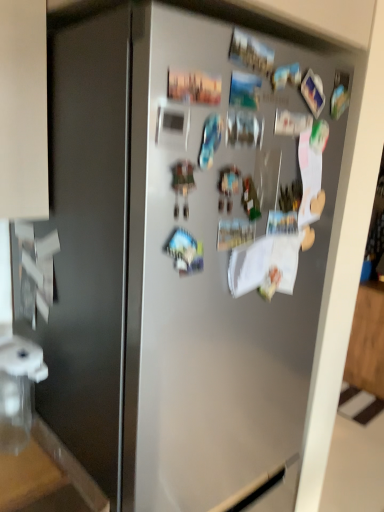
Where is `wooden countertop at lower left`? wooden countertop at lower left is located at coordinates coord(47,478).

What do you see at coordinates (47, 478) in the screenshot? This screenshot has height=512, width=384. I see `wooden countertop at lower left` at bounding box center [47, 478].

Image resolution: width=384 pixels, height=512 pixels. Identify the location of clear plastic water filter at lower left. (17, 389).

The width and height of the screenshot is (384, 512). What do you see at coordinates (17, 389) in the screenshot?
I see `clear plastic water filter at lower left` at bounding box center [17, 389].

At what (x,y) coordinates should I click in order to perform the action: click on wooden countertop at lower left. Please return your answer as a coordinate pair (x, y). Looking at the image, I should click on (47, 478).

Does clear plastic water filter at lower left appear on the left side of wooden countertop at lower left?

No.

Is clear plastic water filter at lower left closer to camera compared to wooden countertop at lower left?

No, clear plastic water filter at lower left is further to the viewer.

Is point (2, 451) closer to camera compared to point (57, 463)?

That is False.

From the image's perspective, is clear plastic water filter at lower left on top of wooden countertop at lower left?

Yes, from the image's perspective, clear plastic water filter at lower left is above wooden countertop at lower left.

From a real-world perspective, does clear plastic water filter at lower left stand above wooden countertop at lower left?

Yes, from a real-world perspective, clear plastic water filter at lower left is above wooden countertop at lower left.

Considering the sizes of clear plastic water filter at lower left and wooden countertop at lower left in the image, is clear plastic water filter at lower left wider or thinner than wooden countertop at lower left?

Considering their sizes, clear plastic water filter at lower left looks slimmer than wooden countertop at lower left.

Considering the sizes of objects clear plastic water filter at lower left and wooden countertop at lower left in the image provided, who is shorter, clear plastic water filter at lower left or wooden countertop at lower left?

Standing shorter between the two is wooden countertop at lower left.

Looking at the image, does clear plastic water filter at lower left seem bigger or smaller compared to wooden countertop at lower left?

Considering their sizes, clear plastic water filter at lower left takes up more space than wooden countertop at lower left.

Is clear plastic water filter at lower left located outside wooden countertop at lower left?

clear plastic water filter at lower left lies outside wooden countertop at lower left's area.

Is clear plastic water filter at lower left beside wooden countertop at lower left?

clear plastic water filter at lower left and wooden countertop at lower left are clearly separated.

Is clear plastic water filter at lower left oriented away from wooden countertop at lower left?

No, clear plastic water filter at lower left is not facing away from wooden countertop at lower left.

You are a GUI agent. You are given a task and a screenshot of the screen. Output one action in this format:
    pyautogui.click(x=<x>, y=<y>)
    Task: Click on the appliance above the wooden countertop at lower left (from the image's perspective)
    This screenshot has height=512, width=384.
    Given the screenshot: What is the action you would take?
    pyautogui.click(x=17, y=389)

Visually, is wooden countertop at lower left positioned to the left or to the right of clear plastic water filter at lower left?

In the image, wooden countertop at lower left appears on the left side of clear plastic water filter at lower left.

Which is in front, wooden countertop at lower left or clear plastic water filter at lower left?

wooden countertop at lower left is in front.

Between point (48, 478) and point (37, 381), which one is positioned in front?

The point (48, 478) is in front.

From the image's perspective, who appears lower, wooden countertop at lower left or clear plastic water filter at lower left?

From the image's view, wooden countertop at lower left is below.

From a real-world perspective, which is physically below, wooden countertop at lower left or clear plastic water filter at lower left?

In real-world perspective, wooden countertop at lower left is lower.

Between wooden countertop at lower left and clear plastic water filter at lower left, which one has smaller width?

Thinner between the two is clear plastic water filter at lower left.

Considering the relative sizes of wooden countertop at lower left and clear plastic water filter at lower left in the image provided, is wooden countertop at lower left shorter than clear plastic water filter at lower left?

Indeed, wooden countertop at lower left has a lesser height compared to clear plastic water filter at lower left.

Is wooden countertop at lower left smaller than clear plastic water filter at lower left?

Correct, wooden countertop at lower left occupies less space than clear plastic water filter at lower left.

Could clear plastic water filter at lower left be considered to be inside wooden countertop at lower left?

No, clear plastic water filter at lower left is located outside of wooden countertop at lower left.

Is wooden countertop at lower left not close to clear plastic water filter at lower left?

No, there isn't a large distance between wooden countertop at lower left and clear plastic water filter at lower left.

Could you tell me if wooden countertop at lower left is facing clear plastic water filter at lower left?

No, wooden countertop at lower left is not turned towards clear plastic water filter at lower left.

How different are the orientations of wooden countertop at lower left and clear plastic water filter at lower left in degrees?

The angular difference between wooden countertop at lower left and clear plastic water filter at lower left is 1.45 degrees.

Measure the distance from wooden countertop at lower left to clear plastic water filter at lower left.

wooden countertop at lower left is 5.42 inches from clear plastic water filter at lower left.

Where is `counter top on the left of clear plastic water filter at lower left`? This screenshot has height=512, width=384. counter top on the left of clear plastic water filter at lower left is located at coordinates (47, 478).

In order to click on appliance on the right of wooden countertop at lower left in this screenshot , I will do `click(17, 389)`.

The width and height of the screenshot is (384, 512). I want to click on appliance behind the wooden countertop at lower left, so click(17, 389).